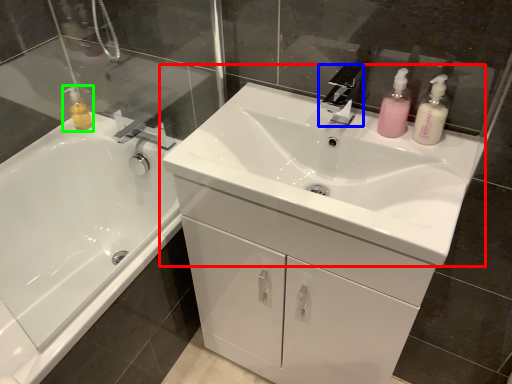
Question: Which object is positioned closest to sink (highlighted by a red box)? Select from tap (highlighted by a blue box) and toiletry (highlighted by a green box).

Choices:
 (A) tap
 (B) toiletry

Answer: (A)